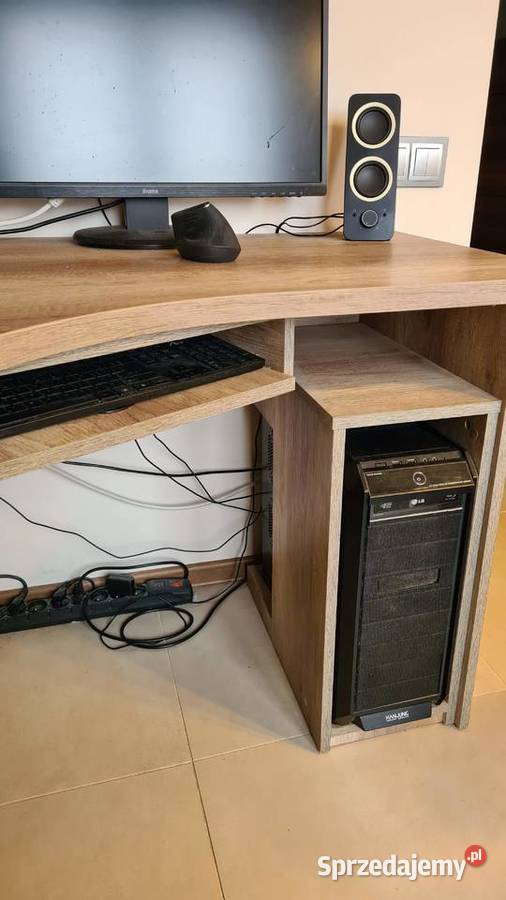
The image size is (506, 900). I want to click on computer, so click(x=394, y=635).